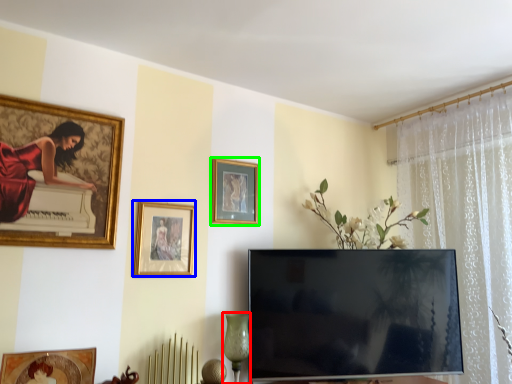
Question: Based on their relative distances, which object is farther from glass vase (highlighted by a red box)? Choose from picture frame (highlighted by a blue box) and picture frame (highlighted by a green box).

Choices:
 (A) picture frame
 (B) picture frame

Answer: (B)